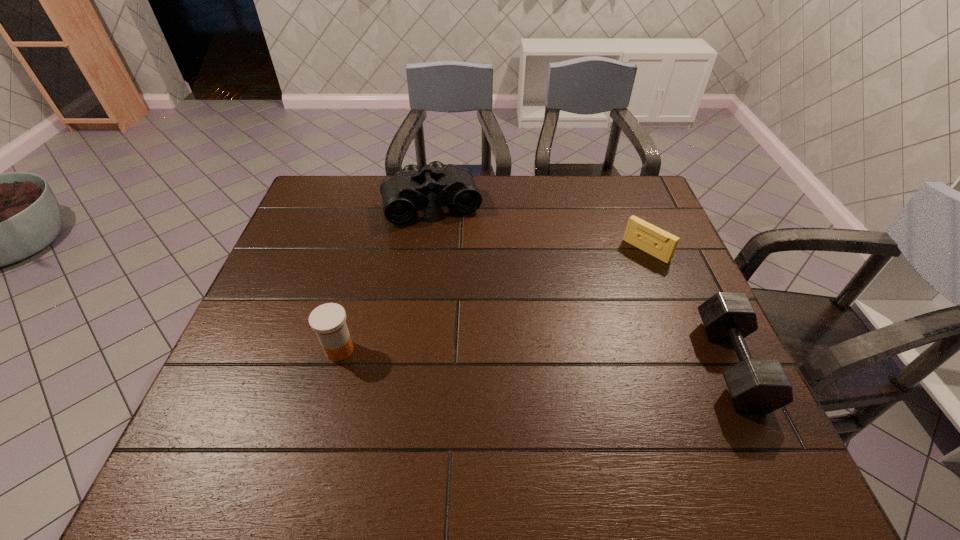
This screenshot has height=540, width=960. I want to click on free space located at the front of the shortest object with spools, so click(x=580, y=309).

Find the location of a particular element. Image resolution: width=960 pixels, height=540 pixels. vacant region located at the front of the shortest object with spools is located at coordinates (589, 301).

Where is `free space located 0.180m at the front of the shortest object with spools`? The image size is (960, 540). free space located 0.180m at the front of the shortest object with spools is located at coordinates (x=598, y=293).

The image size is (960, 540). I want to click on object that is positioned at the far edge, so click(405, 192).

I want to click on object that is at the near edge, so (x=755, y=386).

The image size is (960, 540). I want to click on dumbbell that is positioned at the right edge, so click(755, 386).

Find the location of a particular element. The width and height of the screenshot is (960, 540). videotape positioned at the right edge is located at coordinates (657, 242).

You are a GUI agent. You are given a task and a screenshot of the screen. Output one action in this format:
    pyautogui.click(x=<x>, y=<y>)
    Task: Click on the object located in the near right corner section of the desktop
    
    Given the screenshot: What is the action you would take?
    pyautogui.click(x=755, y=386)

At what (x,y) coordinates should I click in order to perform the action: click on vacant space at the far edge. Please return your answer as a coordinate pair (x, y). The image size is (960, 540). Looking at the image, I should click on (593, 204).

At what (x,y) coordinates should I click in order to perform the action: click on vacant region at the near edge of the desktop. Please return your answer as a coordinate pair (x, y). Image resolution: width=960 pixels, height=540 pixels. Looking at the image, I should click on (338, 413).